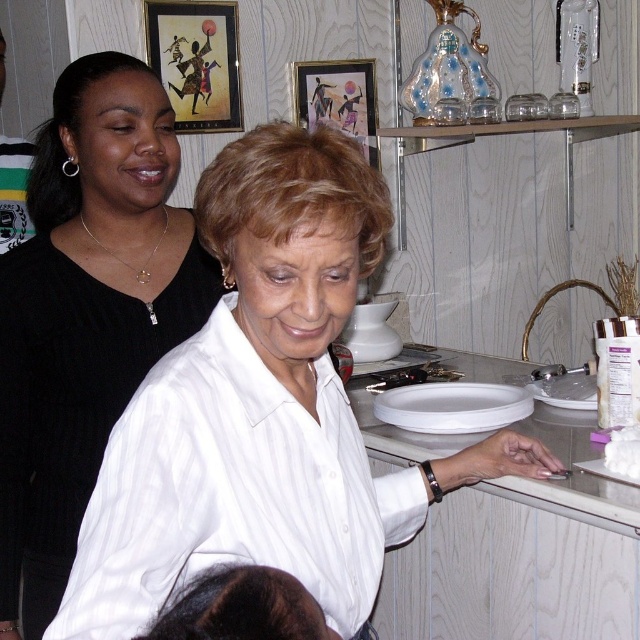
Question: Is white glossy counter top at center smaller than white glossy platter at lower center?

Choices:
 (A) yes
 (B) no

Answer: (B)

Question: Which point is farther from the camera taking this photo?

Choices:
 (A) (64, 128)
 (B) (132, 404)
 (C) (461, 552)

Answer: (C)

Question: Does black matte shirt at upper left come behind white matte platter at lower right?

Choices:
 (A) no
 (B) yes

Answer: (A)

Question: Considering the relative positions of white glossy counter top at center and white fluffy bread at right in the image provided, where is white glossy counter top at center located with respect to white fluffy bread at right?

Choices:
 (A) left
 (B) right

Answer: (A)

Question: Which of the following is the farthest from the observer?

Choices:
 (A) (410, 406)
 (B) (156, 276)
 (C) (566, 404)
 (D) (552, 460)

Answer: (A)

Question: Which point is farther to the camera?

Choices:
 (A) (520, 388)
 (B) (150, 284)
 (C) (560, 616)
 (D) (372, 504)

Answer: (A)